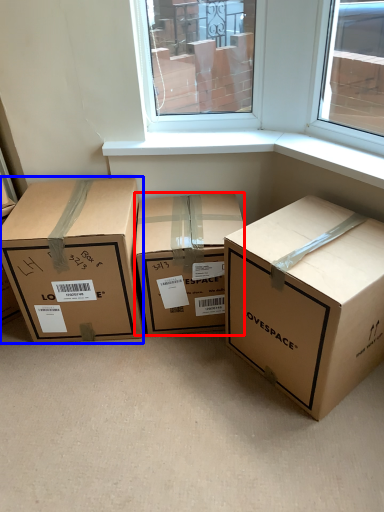
Question: Which of the following is the closest to the observer, box (highlighted by a red box) or box (highlighted by a blue box)?

Choices:
 (A) box
 (B) box

Answer: (B)